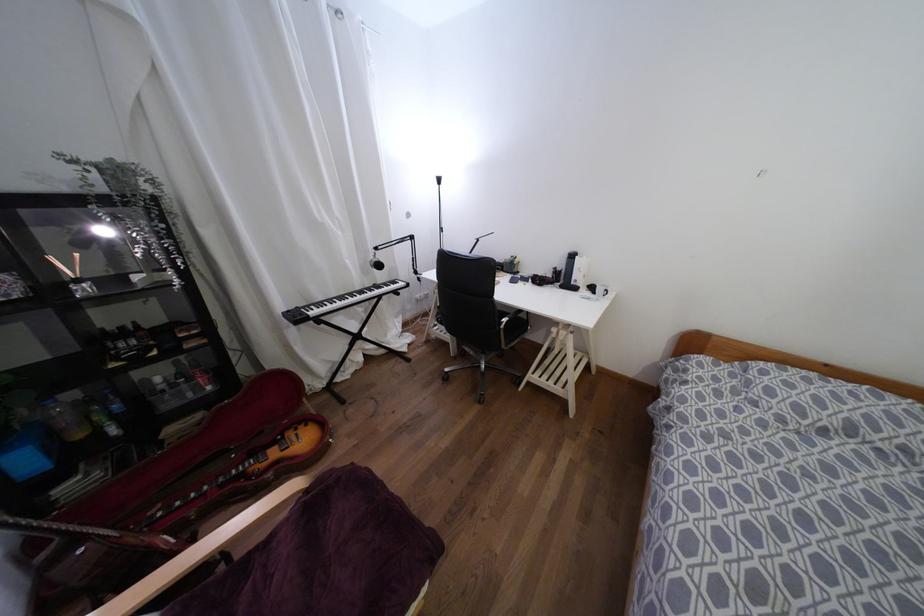
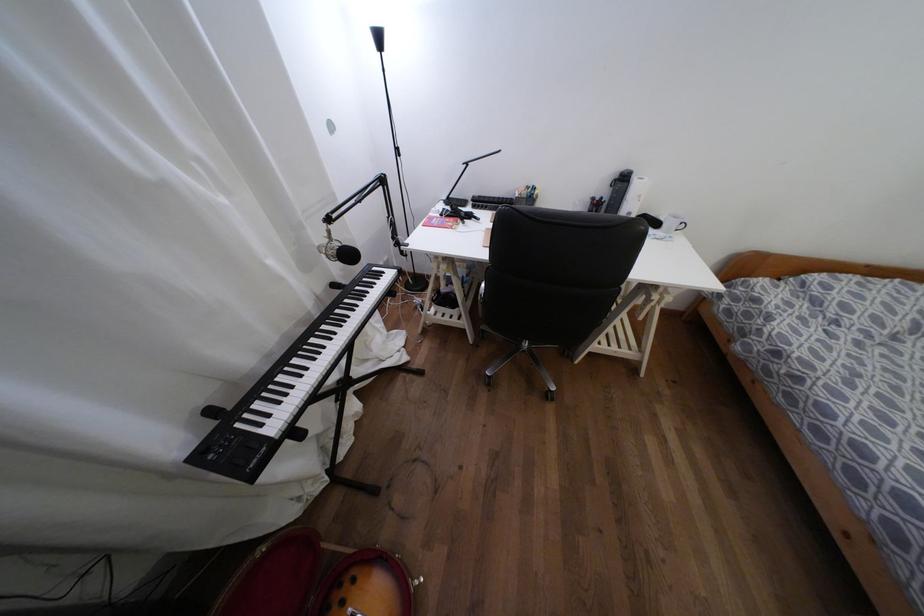
The point at (575,281) is marked in the first image. Where is the corresponding point in the second image?

(628, 213)